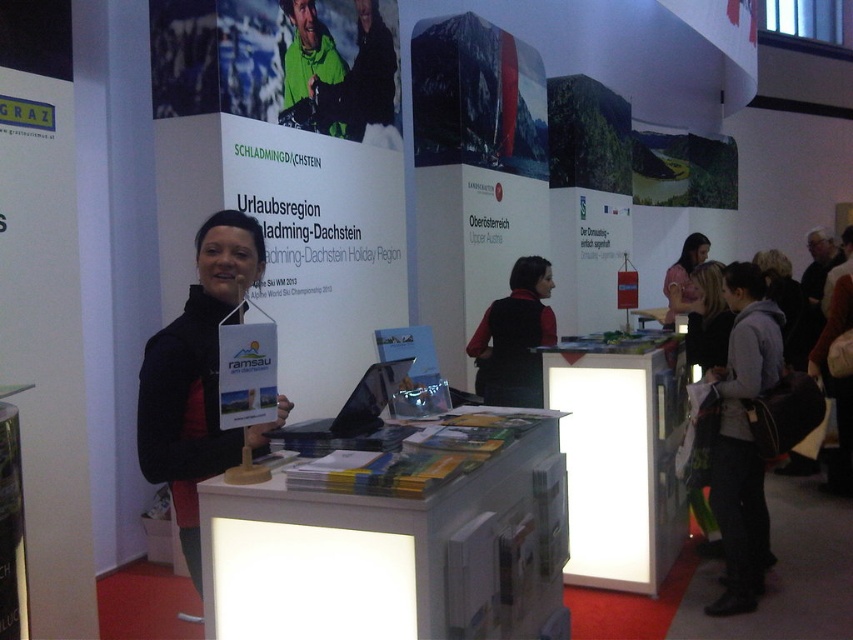
Can you confirm if white plastic table at center is positioned above black fabric at center?

Actually, white plastic table at center is below black fabric at center.

Which is more to the left, white plastic table at center or black fabric at center?

Positioned to the left is black fabric at center.

Is point (496, 560) positioned before point (190, 426)?

Yes.

Where is `white plastic table at center`? The width and height of the screenshot is (853, 640). white plastic table at center is located at coordinates (392, 554).

Between white glossy information desk at center and gray fleece jacket at lower right, which one appears on the right side from the viewer's perspective?

Positioned to the right is gray fleece jacket at lower right.

Measure the distance from white glossy information desk at center to gray fleece jacket at lower right.

They are 14.95 inches apart.

The height and width of the screenshot is (640, 853). Find the location of `white glossy information desk at center`. white glossy information desk at center is located at coordinates 619,458.

Image resolution: width=853 pixels, height=640 pixels. In order to click on black matte laptop at center in this screenshot , I will do `click(355, 404)`.

Identify the location of black matte laptop at center. The height and width of the screenshot is (640, 853). (355, 404).